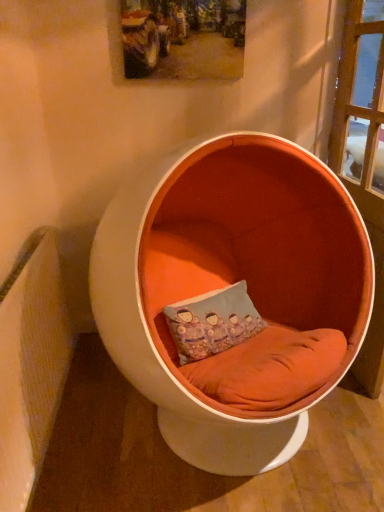
Question: Could orange fabric chair at center be considered to be inside blue fabric pillow at center?

Choices:
 (A) yes
 (B) no

Answer: (B)

Question: Can you confirm if blue fabric pillow at center is positioned to the left of orange fabric chair at center?

Choices:
 (A) yes
 (B) no

Answer: (A)

Question: Is blue fabric pillow at center thinner than orange fabric chair at center?

Choices:
 (A) no
 (B) yes

Answer: (B)

Question: Is blue fabric pillow at center looking in the opposite direction of orange fabric chair at center?

Choices:
 (A) no
 (B) yes

Answer: (B)

Question: Is blue fabric pillow at center further to camera compared to orange fabric chair at center?

Choices:
 (A) yes
 (B) no

Answer: (A)

Question: From the image's perspective, would you say blue fabric pillow at center is positioned over orange fabric chair at center?

Choices:
 (A) yes
 (B) no

Answer: (B)

Question: From the image's perspective, is blue fabric pillow at center above wooden textured picture frame at upper center?

Choices:
 (A) no
 (B) yes

Answer: (A)

Question: Considering the relative sizes of blue fabric pillow at center and wooden textured picture frame at upper center in the image provided, is blue fabric pillow at center shorter than wooden textured picture frame at upper center?

Choices:
 (A) no
 (B) yes

Answer: (A)

Question: Is blue fabric pillow at center looking in the opposite direction of wooden textured picture frame at upper center?

Choices:
 (A) no
 (B) yes

Answer: (A)

Question: Is blue fabric pillow at center outside of wooden textured picture frame at upper center?

Choices:
 (A) no
 (B) yes

Answer: (B)

Question: Would you say blue fabric pillow at center is a long distance from wooden textured picture frame at upper center?

Choices:
 (A) no
 (B) yes

Answer: (B)

Question: Is blue fabric pillow at center facing towards wooden textured picture frame at upper center?

Choices:
 (A) yes
 (B) no

Answer: (B)

Question: From the image's perspective, does wooden textured picture frame at upper center appear lower than blue fabric pillow at center?

Choices:
 (A) no
 (B) yes

Answer: (A)